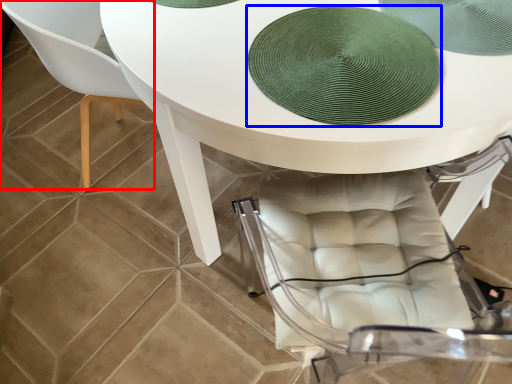
Question: Which of the following is the farthest to the observer, chair (highlighted by a red box) or mat (highlighted by a blue box)?

Choices:
 (A) chair
 (B) mat

Answer: (A)